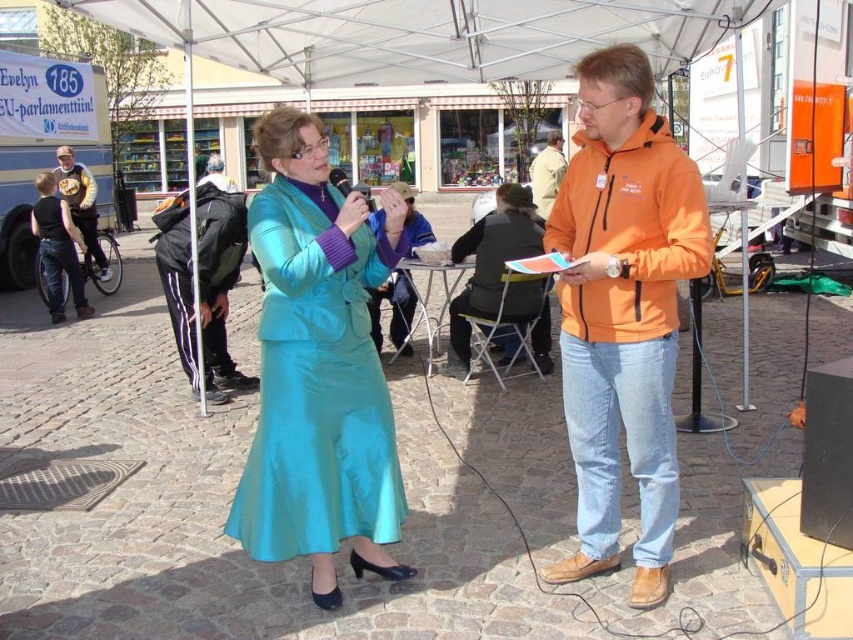
You are a photographer standing at the entrance of the event area. You need to capture a photo that includes both the orange fabric jacket at center and the orange fleece jacket at upper right. Given that your camera has a maximum focal length that allows capturing objects up to 3 meters apart in the same frame, will you be able to include both jackets in a single photo without moving your position?

The orange fabric jacket at center and orange fleece jacket at upper right are 3.38 meters apart, which exceeds the camera maximum focal length of 3 meters. Therefore, you cannot capture both jackets in a single photo without moving your position.

You are standing at the camera position looking at the outdoor event. There are two points marked in the scene. Which point, point 1 at coordinates [509,296] or point 2 at [558,184], is closer to you?

Point 1 at coordinates [509,296] is closer to the camera than point 2 at [558,184].